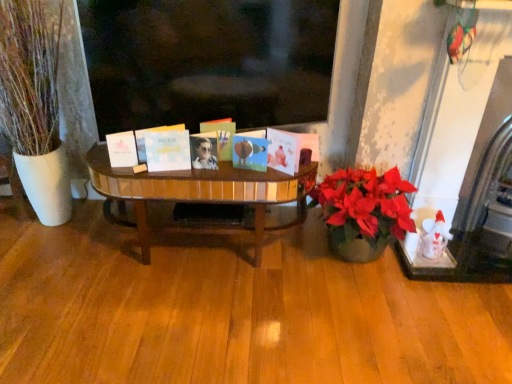
Question: In which direction should I rotate to look at matte blue card at center, arranged as the 4th book when viewed from the left?

Choices:
 (A) right
 (B) left

Answer: (B)

Question: Can you confirm if white matte book at left, marked as the 1th book in a left-to-right arrangement, is thinner than matte blue card at center, arranged as the 4th book when viewed from the left?

Choices:
 (A) no
 (B) yes

Answer: (B)

Question: Does white matte book at left, marked as the 1th book in a left-to-right arrangement, have a larger size compared to matte blue card at center, arranged as the 4th book when viewed from the left?

Choices:
 (A) no
 (B) yes

Answer: (A)

Question: Can you confirm if white matte book at left, marked as the 1th book in a left-to-right arrangement, is taller than matte blue card at center, arranged as the 2th book when viewed from the right?

Choices:
 (A) yes
 (B) no

Answer: (B)

Question: Does white matte book at left, acting as the fifth book starting from the right, have a lesser height compared to matte blue card at center, arranged as the 4th book when viewed from the left?

Choices:
 (A) no
 (B) yes

Answer: (B)

Question: Does white matte book at left, acting as the fifth book starting from the right, have a smaller size compared to matte blue card at center, arranged as the 4th book when viewed from the left?

Choices:
 (A) yes
 (B) no

Answer: (A)

Question: Is white matte book at left, marked as the 1th book in a left-to-right arrangement, next to matte blue card at center, arranged as the 2th book when viewed from the right, and touching it?

Choices:
 (A) yes
 (B) no

Answer: (B)

Question: Is white marble fireplace at right closer to camera compared to metallic photo album at center, placed as the 3th book when sorted from left to right?

Choices:
 (A) no
 (B) yes

Answer: (B)

Question: Considering the relative sizes of white marble fireplace at right and metallic photo album at center, placed as the 3th book when sorted from left to right, in the image provided, is white marble fireplace at right thinner than metallic photo album at center, placed as the 3th book when sorted from left to right,?

Choices:
 (A) no
 (B) yes

Answer: (A)

Question: Does white marble fireplace at right have a lesser height compared to metallic photo album at center, positioned as the third book in right-to-left order?

Choices:
 (A) no
 (B) yes

Answer: (A)

Question: From a real-world perspective, is white marble fireplace at right positioned under metallic photo album at center, placed as the 3th book when sorted from left to right, based on gravity?

Choices:
 (A) yes
 (B) no

Answer: (A)

Question: Considering the relative sizes of white marble fireplace at right and metallic photo album at center, placed as the 3th book when sorted from left to right, in the image provided, is white marble fireplace at right smaller than metallic photo album at center, placed as the 3th book when sorted from left to right,?

Choices:
 (A) yes
 (B) no

Answer: (B)

Question: Considering the relative sizes of white marble fireplace at right and metallic photo album at center, positioned as the third book in right-to-left order, in the image provided, is white marble fireplace at right wider than metallic photo album at center, positioned as the third book in right-to-left order,?

Choices:
 (A) yes
 (B) no

Answer: (A)

Question: From a real-world perspective, is white matte book at center, the fifth book viewed from the left, on white matte card at center, the 4th book from the right?

Choices:
 (A) yes
 (B) no

Answer: (B)